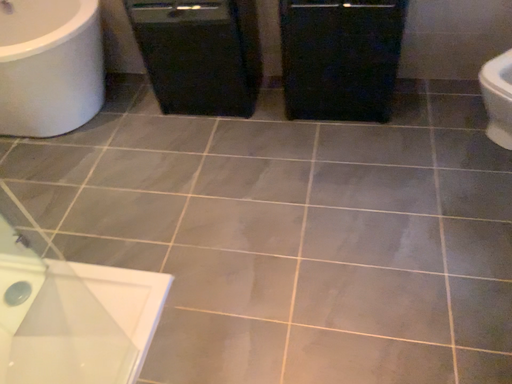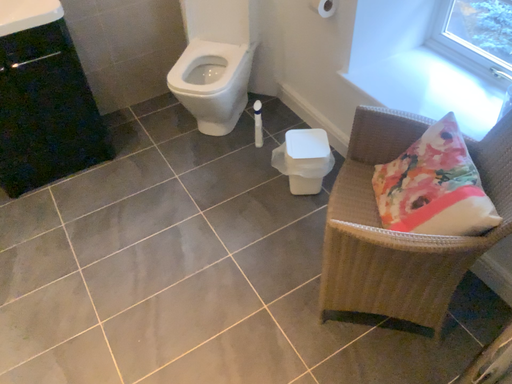
Question: Which way did the camera rotate in the video?

Choices:
 (A) rotated right
 (B) rotated left

Answer: (A)